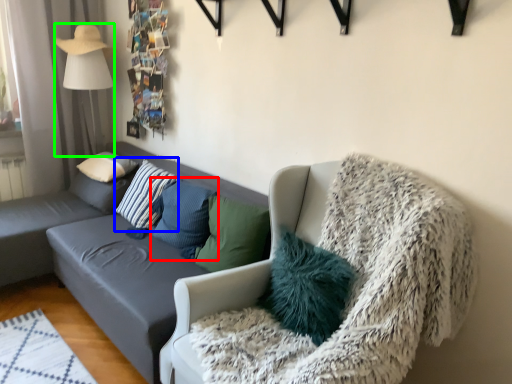
Question: Estimate the real-world distances between objects in this image. Which object is closer to pillow (highlighted by a red box), pillow (highlighted by a blue box) or lamp (highlighted by a green box)?

Choices:
 (A) pillow
 (B) lamp

Answer: (A)